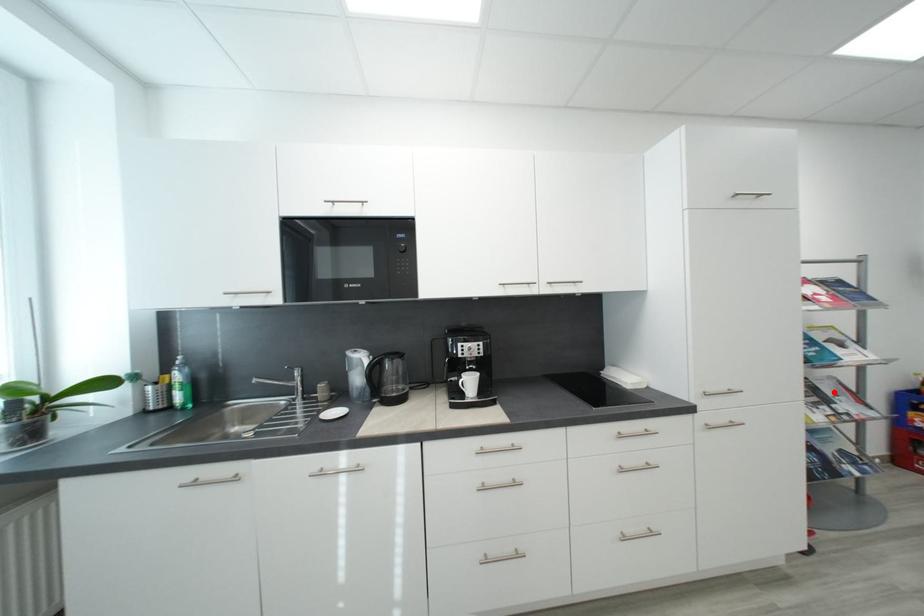
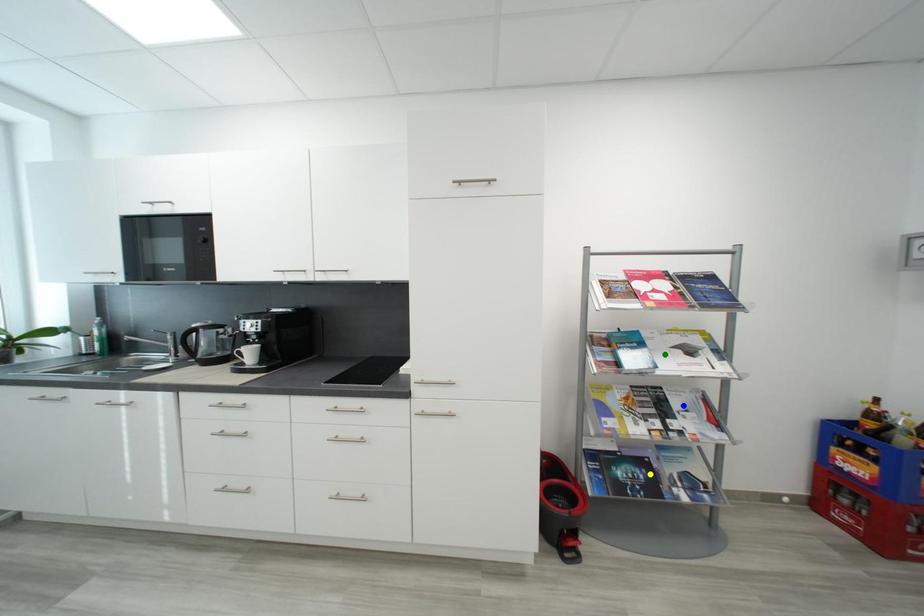
Question: I am providing you with two images of the same scene from different viewpoints. A red point is marked on the first image. You are given multiple points on the second image. In image 2, which mark is for the same physical point as the one in image 1?

Choices:
 (A) yellow point
 (B) green point
 (C) blue point

Answer: (C)